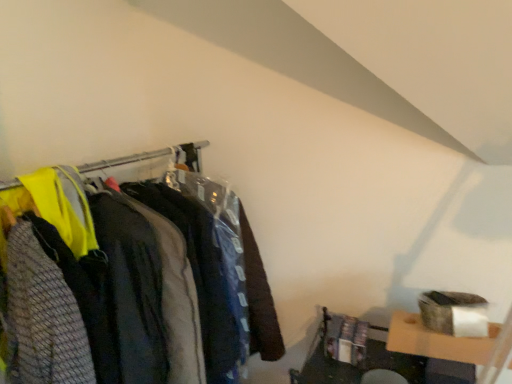
You are a GUI agent. You are given a task and a screenshot of the screen. Output one action in this format:
    pyautogui.click(x=<x>, y=<y>)
    Task: Click on the dark gray fabric jacket at center, the second clothing in the front-to-back sequence
    
    Given the screenshot: What is the action you would take?
    pyautogui.click(x=133, y=288)

What do you see at coordinates (133, 288) in the screenshot? This screenshot has width=512, height=384. I see `dark gray fabric jacket at center, the second clothing in the front-to-back sequence` at bounding box center [133, 288].

What do you see at coordinates (154, 158) in the screenshot? I see `matte black clothing at left` at bounding box center [154, 158].

Measure the distance between point (280,348) and camera.

Point (280,348) is 5.91 feet from camera.

Where is `textured gray sweater at left, the second clothing from the back`? textured gray sweater at left, the second clothing from the back is located at coordinates (42, 317).

The width and height of the screenshot is (512, 384). In order to click on dark gray fabric jacket at center, the second clothing in the front-to-back sequence in this screenshot , I will do `click(133, 288)`.

Looking at their sizes, would you say matte black clothing at left is wider or thinner than textured gray sweater at left, which is counted as the first clothing, starting from the front?

Clearly, matte black clothing at left has less width compared to textured gray sweater at left, which is counted as the first clothing, starting from the front.

Is matte black clothing at left to the left or to the right of textured gray sweater at left, the second clothing from the back, in the image?

matte black clothing at left is positioned on textured gray sweater at left, the second clothing from the back,'s right side.

Can textured gray sweater at left, the second clothing from the back, be found inside matte black clothing at left?

Yes, textured gray sweater at left, the second clothing from the back, is a part of matte black clothing at left.

Is matte black clothing at left positioned with its back to textured gray sweater at left, which is counted as the first clothing, starting from the front?

No, matte black clothing at left is not facing away from textured gray sweater at left, which is counted as the first clothing, starting from the front.

Is matte black clothing at left positioned beyond the bounds of dark gray fabric jacket at center, which appears as the 1th clothing when viewed from the back?

Yes, matte black clothing at left is located beyond the bounds of dark gray fabric jacket at center, which appears as the 1th clothing when viewed from the back.

Could you tell me if matte black clothing at left is facing dark gray fabric jacket at center, which appears as the 1th clothing when viewed from the back?

Yes, matte black clothing at left is oriented towards dark gray fabric jacket at center, which appears as the 1th clothing when viewed from the back.

In terms of size, does matte black clothing at left appear bigger or smaller than dark gray fabric jacket at center, which appears as the 1th clothing when viewed from the back?

matte black clothing at left is bigger than dark gray fabric jacket at center, which appears as the 1th clothing when viewed from the back.

Can you confirm if matte black clothing at left is positioned to the right of dark gray fabric jacket at center, the second clothing in the front-to-back sequence?

In fact, matte black clothing at left is to the left of dark gray fabric jacket at center, the second clothing in the front-to-back sequence.

Considering the sizes of objects textured gray sweater at left, the second clothing from the back, and dark gray fabric jacket at center, the second clothing in the front-to-back sequence, in the image provided, who is thinner, textured gray sweater at left, the second clothing from the back, or dark gray fabric jacket at center, the second clothing in the front-to-back sequence,?

With smaller width is dark gray fabric jacket at center, the second clothing in the front-to-back sequence.

In the scene shown: In terms of size, does textured gray sweater at left, the second clothing from the back, appear bigger or smaller than dark gray fabric jacket at center, which appears as the 1th clothing when viewed from the back?

Considering their sizes, textured gray sweater at left, the second clothing from the back, takes up more space than dark gray fabric jacket at center, which appears as the 1th clothing when viewed from the back.

From the image's perspective, who appears lower, textured gray sweater at left, which is counted as the first clothing, starting from the front, or dark gray fabric jacket at center, which appears as the 1th clothing when viewed from the back?

textured gray sweater at left, which is counted as the first clothing, starting from the front.

Measure the distance from dark gray fabric jacket at center, which appears as the 1th clothing when viewed from the back, to textured gray sweater at left, which is counted as the first clothing, starting from the front.

dark gray fabric jacket at center, which appears as the 1th clothing when viewed from the back, is 20.92 centimeters from textured gray sweater at left, which is counted as the first clothing, starting from the front.

Is dark gray fabric jacket at center, which appears as the 1th clothing when viewed from the back, shorter than textured gray sweater at left, which is counted as the first clothing, starting from the front?

In fact, dark gray fabric jacket at center, which appears as the 1th clothing when viewed from the back, may be taller than textured gray sweater at left, which is counted as the first clothing, starting from the front.

Locate an element on the screen. clothing that is behind the textured gray sweater at left, which is counted as the first clothing, starting from the front is located at coordinates [133, 288].

Between point (122, 269) and point (15, 247), which one is positioned behind?

The point (122, 269) is farther.

Is textured gray sweater at left, which is counted as the first clothing, starting from the front, facing away from matte black clothing at left?

Yes, textured gray sweater at left, which is counted as the first clothing, starting from the front, is facing away from matte black clothing at left.

From a real-world perspective, is textured gray sweater at left, which is counted as the first clothing, starting from the front, above or below matte black clothing at left?

From a real-world perspective, textured gray sweater at left, which is counted as the first clothing, starting from the front, is physically above matte black clothing at left.

Is point (78, 350) closer or farther from the camera than point (141, 161)?

Point (78, 350) is positioned closer to the camera compared to point (141, 161).

Where is `clothing behind the matte black clothing at left`? This screenshot has height=384, width=512. clothing behind the matte black clothing at left is located at coordinates (133, 288).

How far apart are dark gray fabric jacket at center, which appears as the 1th clothing when viewed from the back, and matte black clothing at left?

A distance of 53.93 centimeters exists between dark gray fabric jacket at center, which appears as the 1th clothing when viewed from the back, and matte black clothing at left.

In terms of size, does dark gray fabric jacket at center, the second clothing in the front-to-back sequence, appear bigger or smaller than matte black clothing at left?

In the image, dark gray fabric jacket at center, the second clothing in the front-to-back sequence, appears to be smaller than matte black clothing at left.

I want to click on the 2nd clothing located above the matte black clothing at left (from a real-world perspective), so click(42, 317).

Where is `clothing that appears behind the matte black clothing at left`? This screenshot has width=512, height=384. clothing that appears behind the matte black clothing at left is located at coordinates (133, 288).

Which object lies nearer to the anchor point textured gray sweater at left, which is counted as the first clothing, starting from the front, matte black clothing at left or dark gray fabric jacket at center, the second clothing in the front-to-back sequence?

The object closer to textured gray sweater at left, which is counted as the first clothing, starting from the front, is dark gray fabric jacket at center, the second clothing in the front-to-back sequence.

Based on their spatial positions, is textured gray sweater at left, the second clothing from the back, or matte black clothing at left closer to dark gray fabric jacket at center, the second clothing in the front-to-back sequence?

textured gray sweater at left, the second clothing from the back, is positioned closer to the anchor dark gray fabric jacket at center, the second clothing in the front-to-back sequence.

Looking at the image, which one is located further to matte black clothing at left, dark gray fabric jacket at center, which appears as the 1th clothing when viewed from the back, or textured gray sweater at left, the second clothing from the back?

Among the two, textured gray sweater at left, the second clothing from the back, is located further to matte black clothing at left.

Which object lies further to the anchor point dark gray fabric jacket at center, which appears as the 1th clothing when viewed from the back, matte black clothing at left or textured gray sweater at left, which is counted as the first clothing, starting from the front?

Based on the image, matte black clothing at left appears to be further to dark gray fabric jacket at center, which appears as the 1th clothing when viewed from the back.

From the image, which object appears to be nearer to matte black clothing at left, textured gray sweater at left, the second clothing from the back, or dark gray fabric jacket at center, the second clothing in the front-to-back sequence?

dark gray fabric jacket at center, the second clothing in the front-to-back sequence, is closer to matte black clothing at left.

Based on their spatial positions, is dark gray fabric jacket at center, the second clothing in the front-to-back sequence, or matte black clothing at left closer to textured gray sweater at left, which is counted as the first clothing, starting from the front?

Based on the image, dark gray fabric jacket at center, the second clothing in the front-to-back sequence, appears to be nearer to textured gray sweater at left, which is counted as the first clothing, starting from the front.

Locate an element on the screen. The height and width of the screenshot is (384, 512). closet positioned between textured gray sweater at left, the second clothing from the back, and dark gray fabric jacket at center, the second clothing in the front-to-back sequence, from near to far is located at coordinates (154, 158).